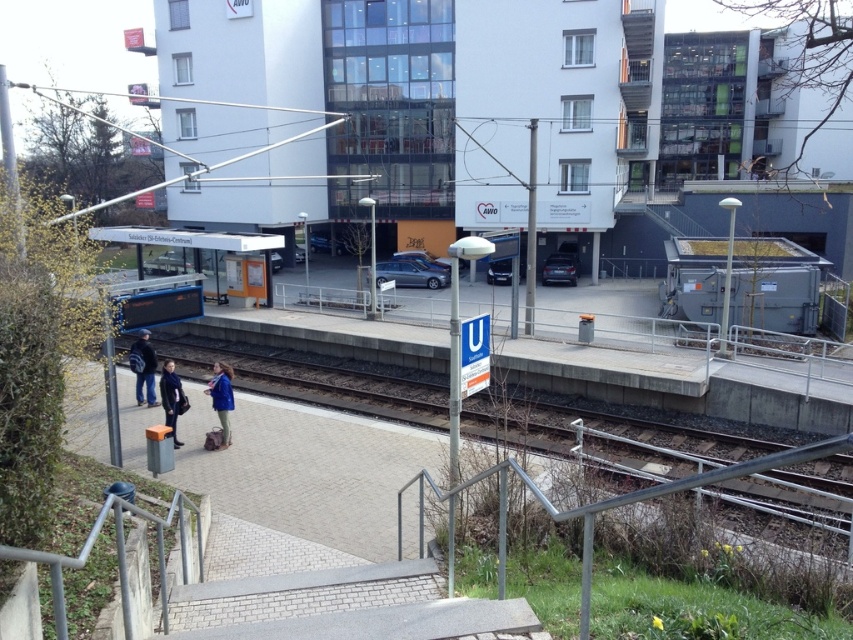
Question: Estimate the real-world distances between objects in this image. Which object is farther from the dark blue jacket at center?

Choices:
 (A) blue fabric coat at center
 (B) dark blue leather jacket at lower left

Answer: (A)

Question: Is dark blue jacket at center further to the viewer compared to dark blue leather jacket at lower left?

Choices:
 (A) yes
 (B) no

Answer: (A)

Question: Can you confirm if dark blue jacket at center is positioned to the right of blue fabric coat at center?

Choices:
 (A) yes
 (B) no

Answer: (B)

Question: From the image, what is the correct spatial relationship of dark blue jacket at center in relation to dark blue leather jacket at lower left?

Choices:
 (A) right
 (B) left

Answer: (B)

Question: Which object is closer to the camera taking this photo?

Choices:
 (A) dark blue jacket at center
 (B) blue fabric coat at center
 (C) dark blue leather jacket at lower left

Answer: (B)

Question: Which of the following is the closest to the observer?

Choices:
 (A) (230, 384)
 (B) (135, 378)

Answer: (A)